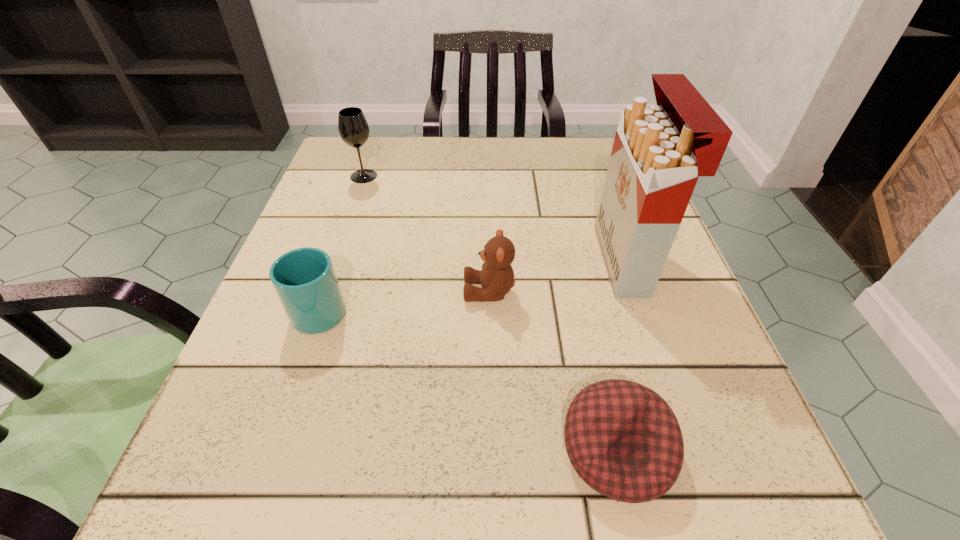
You are a GUI agent. You are given a task and a screenshot of the screen. Output one action in this format:
    pyautogui.click(x=<x>, y=<y>)
    Task: Click on the wineglass located at the left edge
    
    Given the screenshot: What is the action you would take?
    pyautogui.click(x=353, y=128)

I want to click on cup that is at the left edge, so click(x=304, y=279).

I want to click on cigarette case at the right edge, so click(x=659, y=151).

Identify the location of beanbag situated at the right edge. Image resolution: width=960 pixels, height=540 pixels. (624, 441).

Locate an element on the screen. Image resolution: width=960 pixels, height=540 pixels. object that is at the far left corner is located at coordinates (353, 128).

I want to click on object at the near right corner, so click(x=624, y=441).

Identify the location of blank space at the far edge. This screenshot has width=960, height=540. (419, 148).

At what (x,y) coordinates should I click in order to perform the action: click on vacant space at the left edge of the desktop. Please return your answer as a coordinate pair (x, y). Looking at the image, I should click on (325, 426).

Locate an element on the screen. Image resolution: width=960 pixels, height=540 pixels. free space at the right edge of the desktop is located at coordinates (588, 214).

This screenshot has width=960, height=540. Find the location of `free location at the near left corner of the desktop`. free location at the near left corner of the desktop is located at coordinates (263, 526).